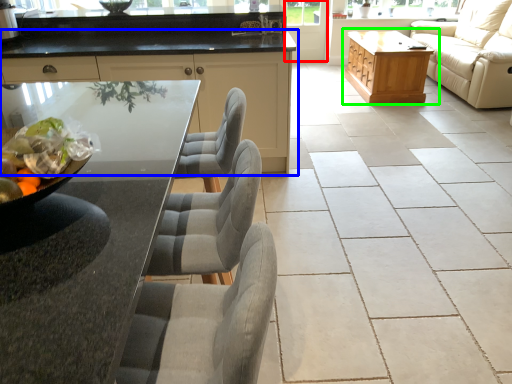
Question: Considering the real-world distances, which object is farthest from screen door (highlighted by a red box)? cabinetry (highlighted by a blue box) or table (highlighted by a green box)?

Choices:
 (A) cabinetry
 (B) table

Answer: (A)